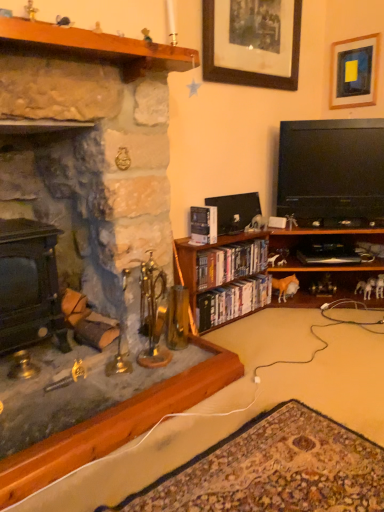
What are the coordinates of `free space above hardcover books at center, arranged as the third book when viewed from the top (from a real-world perspective)` in the screenshot? It's located at 227,287.